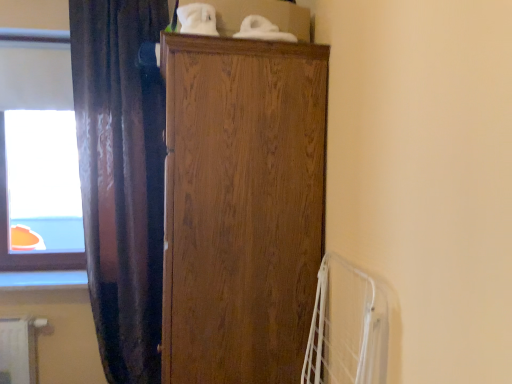
Locate an element on the screen. The width and height of the screenshot is (512, 384). dark velvet curtain at left is located at coordinates (121, 178).

Is transparent glass window at upper left bigger than dark velvet curtain at left?

Actually, transparent glass window at upper left might be smaller than dark velvet curtain at left.

Is transparent glass window at upper left in contact with dark velvet curtain at left?

No, transparent glass window at upper left is not in contact with dark velvet curtain at left.

Is point (73, 246) positioned after point (157, 221)?

Yes, it is.

Considering the positions of objects dark velvet curtain at left and wooden cabinet at center in the image provided, who is more to the left, dark velvet curtain at left or wooden cabinet at center?

dark velvet curtain at left is more to the left.

Is dark velvet curtain at left oriented away from wooden cabinet at center?

No, dark velvet curtain at left's orientation is not away from wooden cabinet at center.

I want to click on curtain located behind the wooden cabinet at center, so click(121, 178).

From a real-world perspective, is wooden cabinet at center positioned above or below dark velvet curtain at left?

wooden cabinet at center is situated lower than dark velvet curtain at left in the real world.

From the image's perspective, which is below, wooden cabinet at center or dark velvet curtain at left?

From the image's view, wooden cabinet at center is below.

Which object is positioned more to the left, wooden cabinet at center or dark velvet curtain at left?

Result: Positioned to the left is dark velvet curtain at left.

Could you tell me if dark velvet curtain at left is turned towards transparent glass window at upper left?

No, dark velvet curtain at left is not aimed at transparent glass window at upper left.

From the image's perspective, which one is positioned higher, dark velvet curtain at left or transparent glass window at upper left?

transparent glass window at upper left appears higher in the image.

Is dark velvet curtain at left in front of transparent glass window at upper left?

Yes, dark velvet curtain at left is closer to the camera.

Is transparent glass window at upper left far away from wooden cabinet at center?

transparent glass window at upper left is far away from wooden cabinet at center.

From a real-world perspective, is transparent glass window at upper left located beneath wooden cabinet at center?

No.

How far apart are transparent glass window at upper left and wooden cabinet at center?

transparent glass window at upper left is 1.28 meters away from wooden cabinet at center.

Based on the photo, considering the sizes of objects transparent glass window at upper left and wooden cabinet at center in the image provided, who is taller, transparent glass window at upper left or wooden cabinet at center?

Standing taller between the two is wooden cabinet at center.

Consider the image. Which is less distant, (270, 56) or (52, 67)?

Positioned in front is point (270, 56).

Considering the sizes of wooden cabinet at center and transparent glass window at upper left in the image, is wooden cabinet at center bigger or smaller than transparent glass window at upper left?

In the image, wooden cabinet at center appears to be larger than transparent glass window at upper left.

The height and width of the screenshot is (384, 512). I want to click on cupboard below the transparent glass window at upper left (from a real-world perspective), so click(x=241, y=207).

Is wooden cabinet at center wider or thinner than transparent glass window at upper left?

Clearly, wooden cabinet at center has more width compared to transparent glass window at upper left.

I want to click on window above the dark velvet curtain at left (from a real-world perspective), so click(x=38, y=155).

The height and width of the screenshot is (384, 512). What are the coordinates of `cupboard directly beneath the dark velvet curtain at left (from a real-world perspective)` in the screenshot? It's located at (241, 207).

Considering their positions, is transparent glass window at upper left positioned further to dark velvet curtain at left than wooden cabinet at center?

The object further to dark velvet curtain at left is wooden cabinet at center.

Based on their spatial positions, is transparent glass window at upper left or dark velvet curtain at left closer to wooden cabinet at center?

dark velvet curtain at left is closer to wooden cabinet at center.

Which object lies nearer to the anchor point dark velvet curtain at left, wooden cabinet at center or transparent glass window at upper left?

Among the two, transparent glass window at upper left is located nearer to dark velvet curtain at left.

When comparing their distances from transparent glass window at upper left, does wooden cabinet at center or dark velvet curtain at left seem closer?

dark velvet curtain at left is closer to transparent glass window at upper left.

Which object lies nearer to the anchor point transparent glass window at upper left, dark velvet curtain at left or wooden cabinet at center?

dark velvet curtain at left is positioned closer to the anchor transparent glass window at upper left.

Considering their positions, is dark velvet curtain at left positioned further to wooden cabinet at center than transparent glass window at upper left?

transparent glass window at upper left lies further to wooden cabinet at center than the other object.

The width and height of the screenshot is (512, 384). Find the location of `curtain between transparent glass window at upper left and wooden cabinet at center`. curtain between transparent glass window at upper left and wooden cabinet at center is located at coordinates (121, 178).